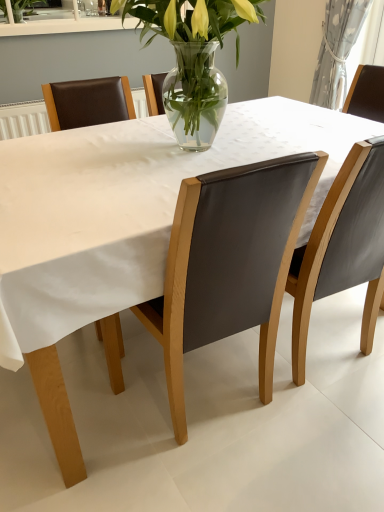
Where is `free space behind matte gray chair at right, the 1th chair in the right-to-left sequence`? free space behind matte gray chair at right, the 1th chair in the right-to-left sequence is located at coordinates (325, 314).